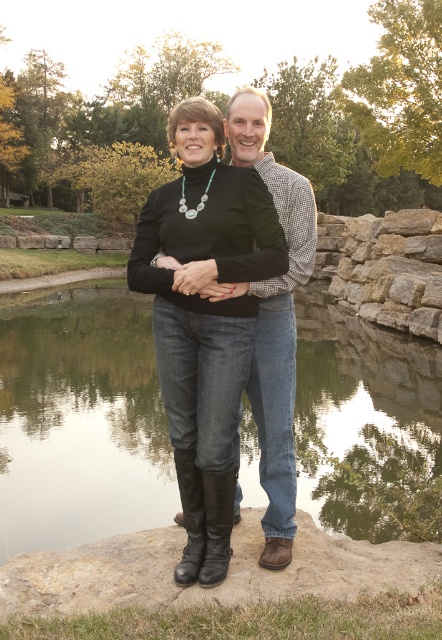
You are a photographer planning to capture the reflection of the transparent glass water at center and the black leather boots at center in this serene outdoor setting. Since reflections depend on the surface being still and the object being above the water, which object will have a clearer reflection in the water?

The transparent glass water at center has a greater height compared to the black leather boots at center, so the reflection of the transparent glass water at center will be clearer because it is taller and more above the water surface.

You are standing on the stone ledge and want to toss a small pebble into the transparent glass water at center. If your arm can reach 1.5 meters, will you be able to reach the water?

The transparent glass water at center is 5.03 meters away from the viewer. Since your arm can only reach 1.5 meters, you cannot reach the water with your arm.